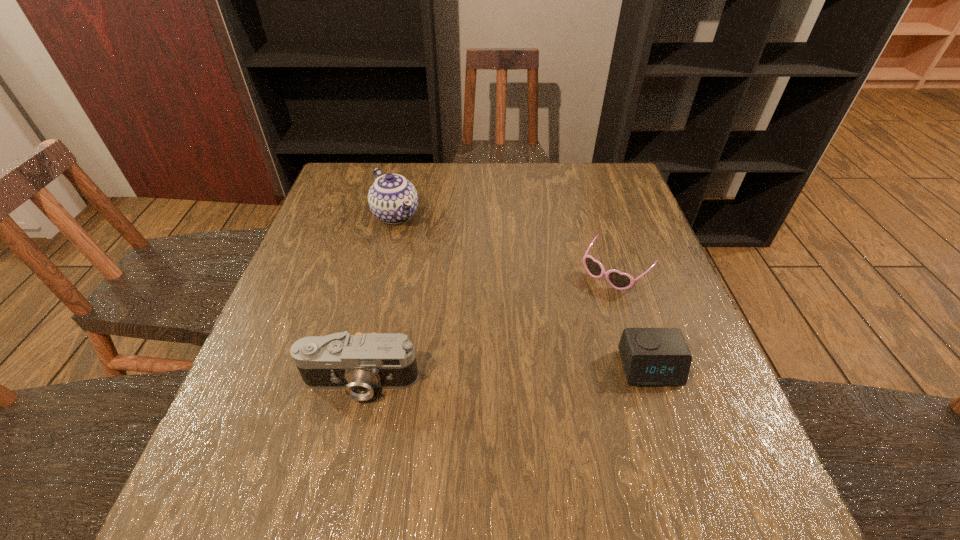
The image size is (960, 540). I want to click on free space located on the front-facing side of the sunglasses, so click(x=585, y=303).

Identify the location of blank space located 0.310m at the spout of the farthest object. The image size is (960, 540). (468, 303).

Where is `free space located 0.300m at the spout of the farthest object`? This screenshot has height=540, width=960. free space located 0.300m at the spout of the farthest object is located at coordinates (466, 300).

Identify the location of free space located at the spout of the farthest object. Image resolution: width=960 pixels, height=540 pixels. (475, 311).

This screenshot has height=540, width=960. I want to click on object that is at the far edge, so click(393, 199).

Find the location of a particular element. object that is at the near edge is located at coordinates (359, 363).

This screenshot has width=960, height=540. In order to click on camera positioned at the left edge in this screenshot , I will do `click(359, 363)`.

Identify the location of chinaware at the left edge. This screenshot has width=960, height=540. (393, 199).

This screenshot has width=960, height=540. Identify the location of alarm clock that is at the right edge. (652, 357).

Where is `sunglasses that is at the right edge`? sunglasses that is at the right edge is located at coordinates (621, 281).